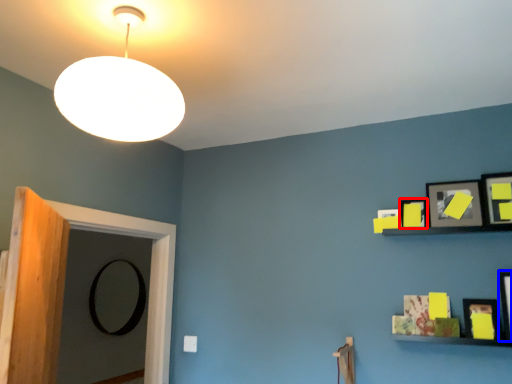
Question: Among these objects, which one is nearest to the camera, picture frame (highlighted by a red box) or picture frame (highlighted by a blue box)?

Choices:
 (A) picture frame
 (B) picture frame

Answer: (B)